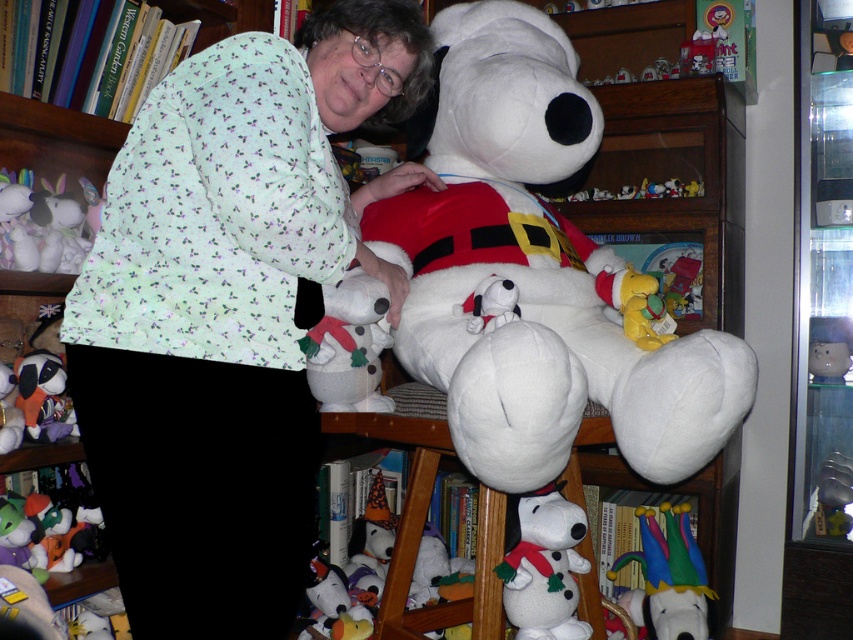
You are a photographer trying to capture a clear shot of both the light green printed fabric at center and the white plush bear at center. Which object should you focus on first to ensure both are in focus?

You should focus on the light green printed fabric at center first because it is closer to the viewer than the white plush bear at center, allowing you to adjust the focus to include both objects.

Looking at this image, you are a delivery person who just arrived with a small package for the owner of the light green printed fabric at center and the white plush bear at center. The delivery requires that you place the package exactly between these two items. Given their current positions, can you position the package precisely in the middle? Explain your reasoning.

The light green printed fabric at center is 11.68 inches from the white plush bear at center. Since the distance between them is measurable, you can place the package exactly halfway between them by dividing the distance by two, resulting in 5.84 inches from each item.